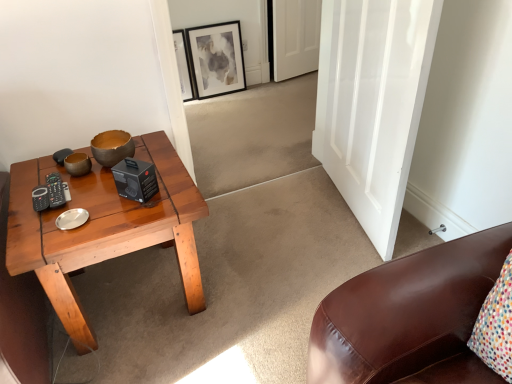
Locate an element on the screen. Image resolution: width=512 pixels, height=384 pixels. vacant region to the left of white glossy door at center, the second door when ordered from back to front is located at coordinates (276, 225).